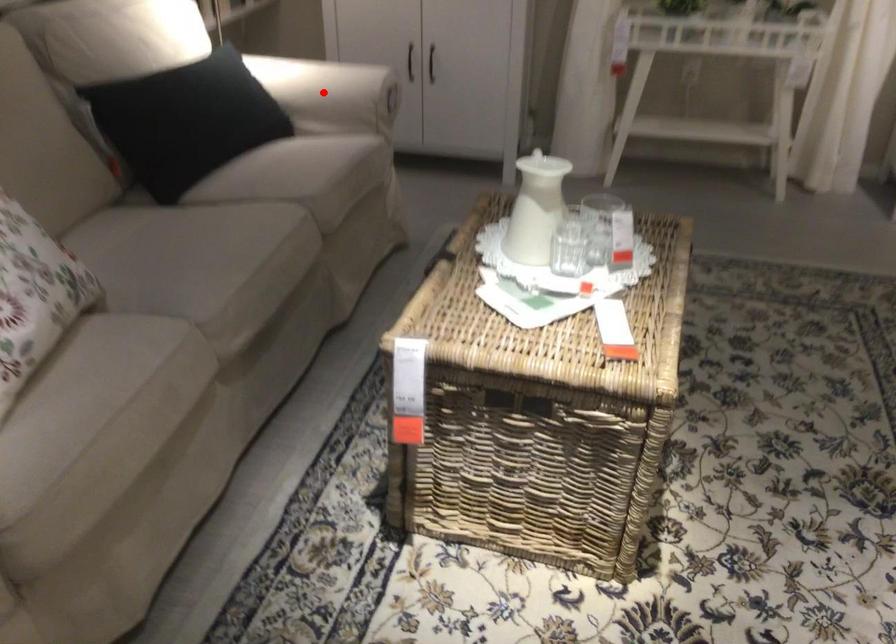
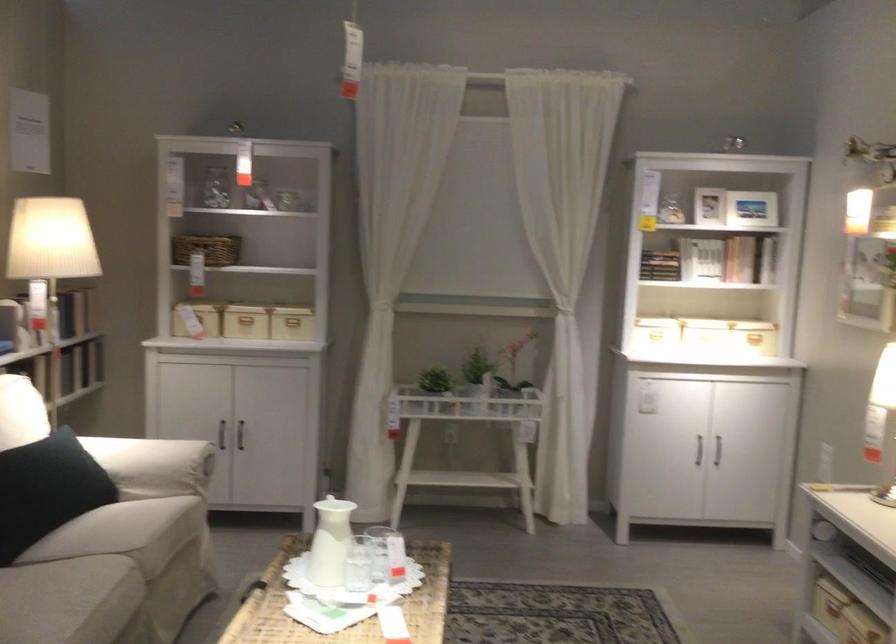
The point at the highlighted location is marked in the first image. Where is the corresponding point in the second image?

(152, 465)